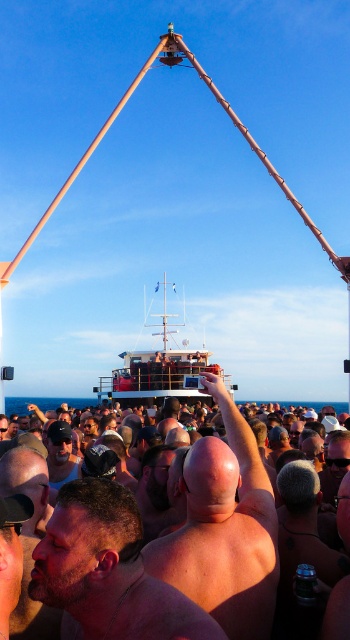
Question: Can you confirm if bald head at center is positioned above wooden ship at center?

Choices:
 (A) no
 (B) yes

Answer: (A)

Question: Which point is farther to the camera?

Choices:
 (A) (60, 580)
 (B) (273, 500)

Answer: (B)

Question: Which point is farther from the camera taking this photo?

Choices:
 (A) (266, 509)
 (B) (183, 378)
 (C) (65, 484)
 (D) (116, 618)

Answer: (B)

Question: Which point appears farthest from the camera in this image?

Choices:
 (A) (220, 637)
 (B) (205, 493)
 (C) (199, 384)

Answer: (C)

Question: Does bald head at center appear over dark brown skin at center?

Choices:
 (A) yes
 (B) no

Answer: (A)

Question: Is beige skin at center positioned at the back of dark brown skin at center?

Choices:
 (A) yes
 (B) no

Answer: (A)